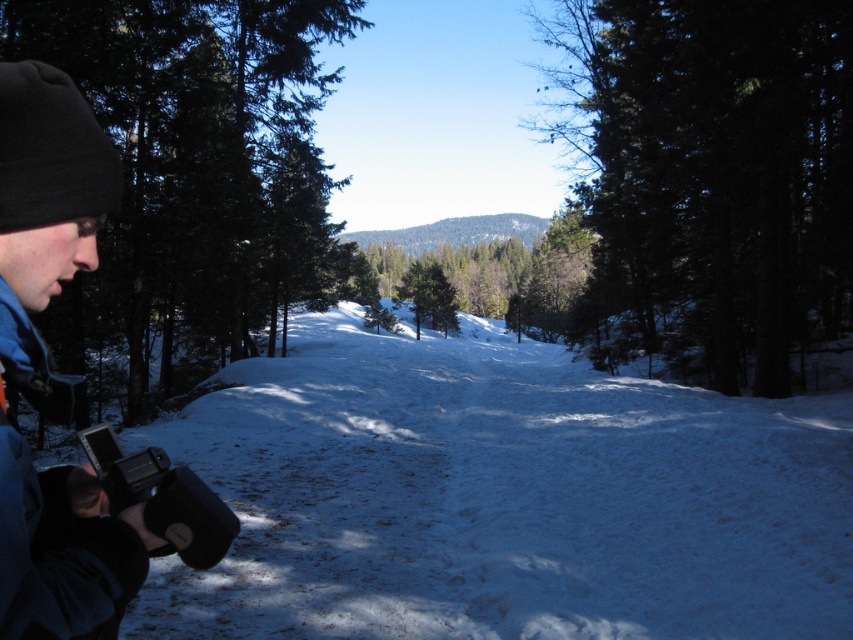
Question: Which is farther from the green matte tree at center?

Choices:
 (A) white powdery snow at center
 (B) green matte tree at left

Answer: (B)

Question: Which is nearer to the green matte tree at center?

Choices:
 (A) green matte tree at left
 (B) blue fleece jacket at lower left

Answer: (A)

Question: Which of the following is the farthest from the observer?

Choices:
 (A) (704, 289)
 (B) (161, 48)
 (C) (370, 484)
 (D) (62, 540)

Answer: (A)

Question: Is green matte tree at left wider than blue fleece jacket at lower left?

Choices:
 (A) yes
 (B) no

Answer: (A)

Question: Is white powdery snow at center to the left of green matte tree at left from the viewer's perspective?

Choices:
 (A) yes
 (B) no

Answer: (B)

Question: Can you confirm if green matte tree at center is positioned above blue fleece jacket at lower left?

Choices:
 (A) no
 (B) yes

Answer: (B)